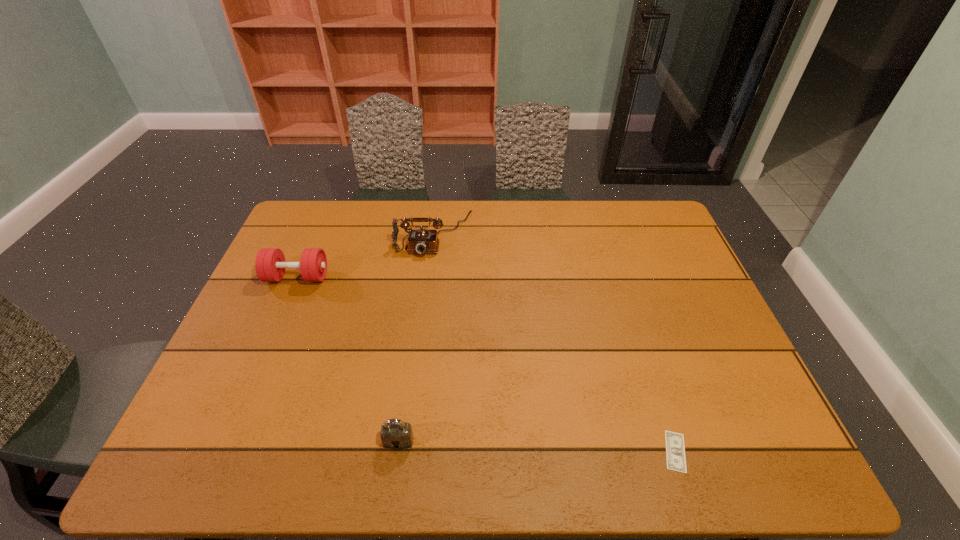
You are a GUI agent. You are given a task and a screenshot of the screen. Output one action in this format:
    pyautogui.click(x=<x>, y=<y>)
    Task: Click on the object that is at the far edge
    Image resolution: width=960 pixels, height=540 pixels.
    Given the screenshot: What is the action you would take?
    pyautogui.click(x=421, y=241)

Locate an element on the screen. The width and height of the screenshot is (960, 540). padlock positioned at the near edge is located at coordinates (395, 434).

The width and height of the screenshot is (960, 540). I want to click on money located at the near edge, so click(675, 451).

The width and height of the screenshot is (960, 540). What are the coordinates of `object situated at the left edge` in the screenshot? It's located at (270, 265).

Identify the location of vacant space at the far edge of the desktop. The width and height of the screenshot is (960, 540). (388, 211).

Where is `vacant space at the near edge of the desktop`? vacant space at the near edge of the desktop is located at coordinates (330, 454).

Identify the location of vacant region at the left edge of the desktop. The image size is (960, 540). (221, 366).

You are a GUI agent. You are given a task and a screenshot of the screen. Output one action in this format:
    pyautogui.click(x=<x>, y=<y>)
    Task: Click on the free spot at the right edge of the desktop
    
    Given the screenshot: What is the action you would take?
    pyautogui.click(x=684, y=332)

I want to click on vacant space at the far left corner of the desktop, so click(315, 241).

Locate an element on the screen. The width and height of the screenshot is (960, 540). free space at the far right corner of the desktop is located at coordinates (653, 214).